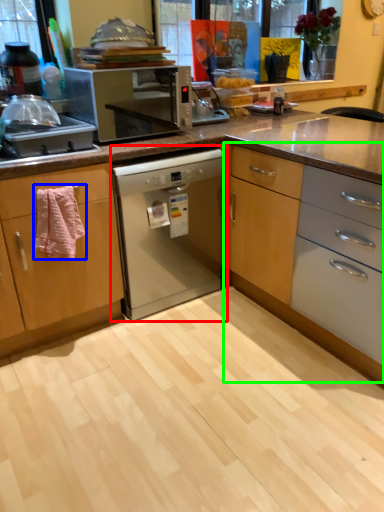
Question: Estimate the real-world distances between objects in this image. Which object is farther from home appliance (highlighted by a red box), cloth (highlighted by a blue box) or cabinetry (highlighted by a green box)?

Choices:
 (A) cloth
 (B) cabinetry

Answer: (A)